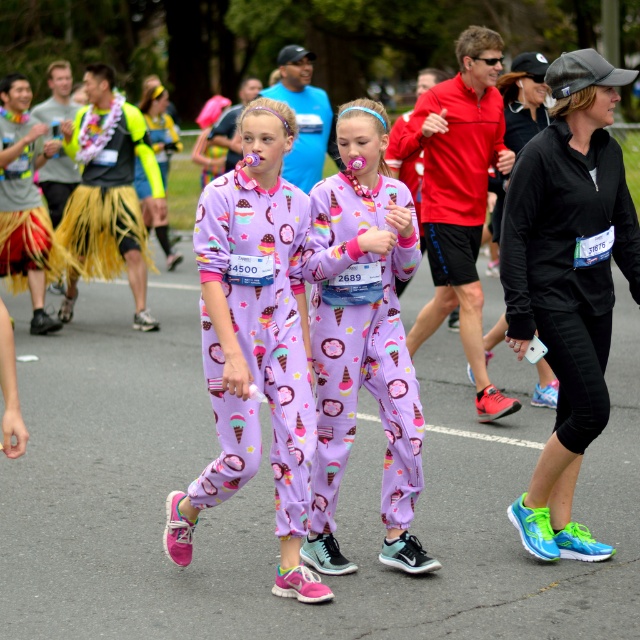
Does point (611, 189) come farther from viewer compared to point (296, 556)?

That is True.

Locate an element on the screen. The image size is (640, 640). neon green running shoes at center is located at coordinates (566, 282).

Is purple cotton onesie at center positioned in front of lavender soft fabric onesie at center?

Yes.

Locate an element on the screen. The width and height of the screenshot is (640, 640). purple cotton onesie at center is located at coordinates (253, 342).

Between point (298, 492) and point (392, 236), which one is positioned behind?

The point (392, 236) is behind.

You are a GUI agent. You are given a task and a screenshot of the screen. Output one action in this format:
    pyautogui.click(x=<x>, y=<y>)
    Task: Click on the purple cotton onesie at center
    
    Given the screenshot: What is the action you would take?
    pyautogui.click(x=253, y=342)

Is the position of neon green running shoes at center less distant than that of lavender soft fabric onesie at center?

Yes, it is in front of lavender soft fabric onesie at center.

Can you confirm if neon green running shoes at center is wider than lavender soft fabric onesie at center?

Indeed, neon green running shoes at center has a greater width compared to lavender soft fabric onesie at center.

Is point (624, 177) closer to camera compared to point (360, 321)?

No.

I want to click on neon green running shoes at center, so click(x=566, y=282).